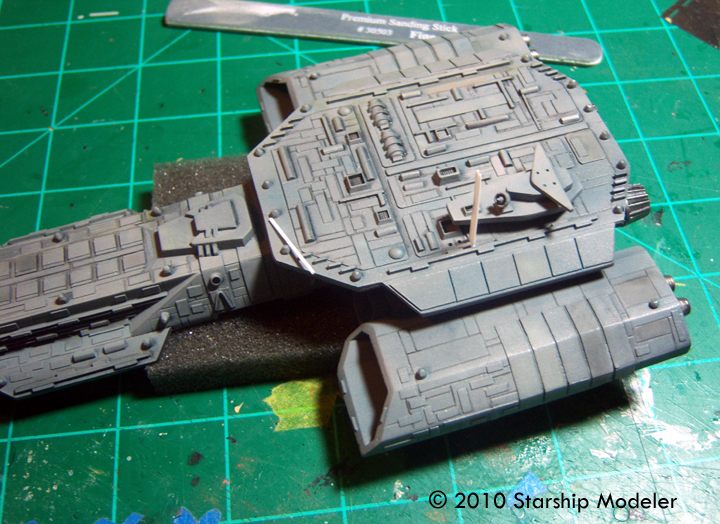
The width and height of the screenshot is (720, 524). I want to click on dark grey sponge, so click(x=225, y=347).